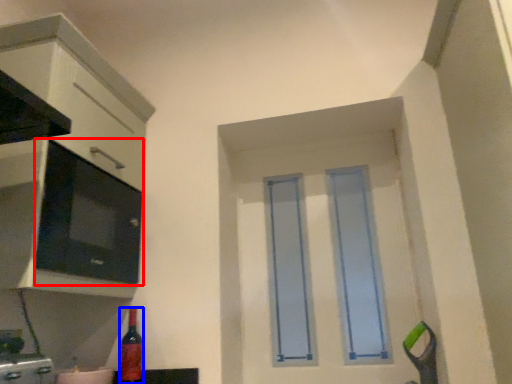
Question: Among these objects, which one is nearest to the camera, appliance (highlighted by a red box) or bottle (highlighted by a blue box)?

Choices:
 (A) appliance
 (B) bottle

Answer: (A)